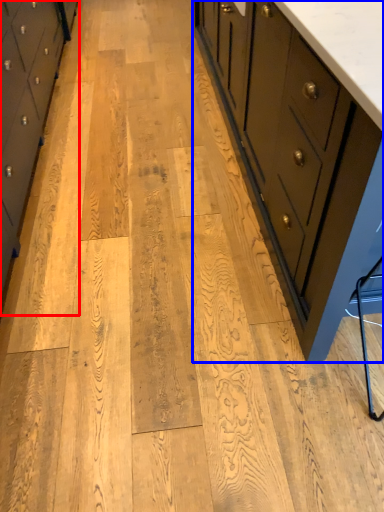
Question: Which object appears closest to the camera in this image, chest of drawers (highlighted by a red box) or chest of drawers (highlighted by a blue box)?

Choices:
 (A) chest of drawers
 (B) chest of drawers

Answer: (B)